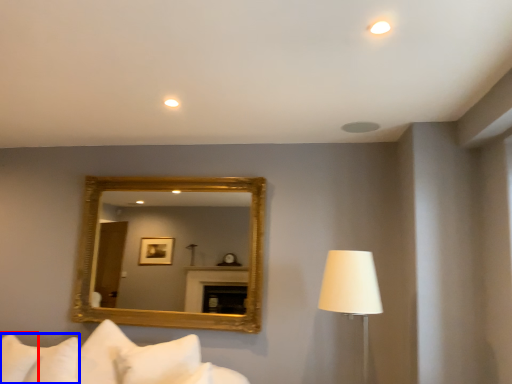
Question: Which point is further to the camera, pillow (highlighted by a red box) or pillow (highlighted by a blue box)?

Choices:
 (A) pillow
 (B) pillow

Answer: (A)